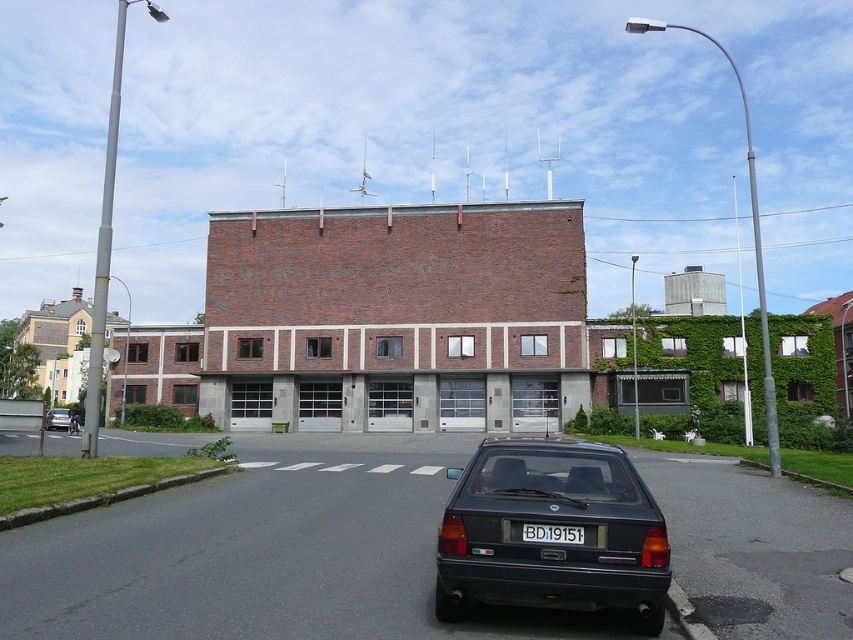
Question: Is matte black hatchback at center bigger than matte black car at lower center?

Choices:
 (A) yes
 (B) no

Answer: (B)

Question: Which of these objects is positioned closest to the black plastic license plate at center?

Choices:
 (A) matte black car at lower center
 (B) matte black hatchback at center

Answer: (B)

Question: Does matte black hatchback at center appear over black plastic license plate at center?

Choices:
 (A) yes
 (B) no

Answer: (B)

Question: Estimate the real-world distances between objects in this image. Which object is farther from the matte black car at lower center?

Choices:
 (A) matte black hatchback at center
 (B) black plastic license plate at center

Answer: (A)

Question: Is matte black hatchback at center closer to camera compared to matte black car at lower center?

Choices:
 (A) yes
 (B) no

Answer: (A)

Question: Estimate the real-world distances between objects in this image. Which object is closer to the matte black car at lower center?

Choices:
 (A) black plastic license plate at center
 (B) matte black hatchback at center

Answer: (A)